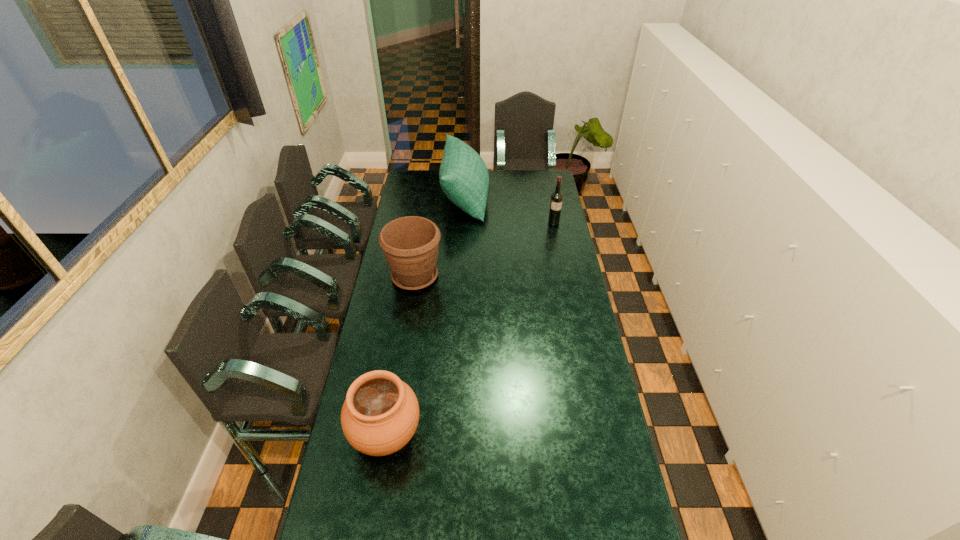
At what (x,y) coordinates should I click in order to perform the action: click on pottery that is at the left edge. Please return your answer as a coordinate pair (x, y). Looking at the image, I should click on (380, 414).

I want to click on object at the right edge, so click(x=556, y=198).

Identify the location of free space at the far edge of the desktop. (437, 188).

Identify the location of vacant space at the left edge. (421, 205).

In order to click on blank space at the right edge of the desktop in this screenshot , I will do `click(573, 281)`.

In the image, there is a desktop. Where is `vacant space at the far left corner`? The image size is (960, 540). vacant space at the far left corner is located at coordinates pyautogui.click(x=414, y=179).

Where is `vacant space that is in between the wine bottle and the pottery`? vacant space that is in between the wine bottle and the pottery is located at coordinates (470, 329).

Where is `blank region between the wine bottle and the second nearest object`? The height and width of the screenshot is (540, 960). blank region between the wine bottle and the second nearest object is located at coordinates (484, 250).

This screenshot has width=960, height=540. What are the coordinates of `vacant point located between the cushion and the rightmost object` in the screenshot? It's located at (510, 210).

Where is `empty location between the cushion and the pottery`? Image resolution: width=960 pixels, height=540 pixels. empty location between the cushion and the pottery is located at coordinates (426, 316).